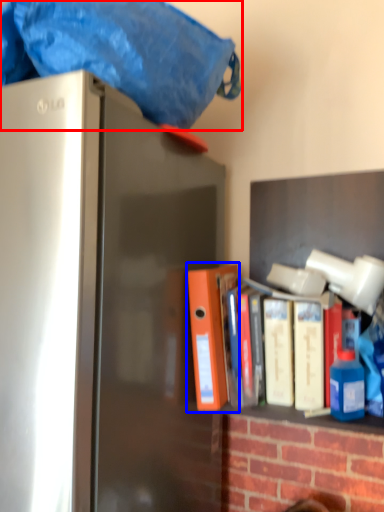
Question: Which point is further to the camera, blanket (highlighted by a red box) or book (highlighted by a blue box)?

Choices:
 (A) blanket
 (B) book

Answer: (B)